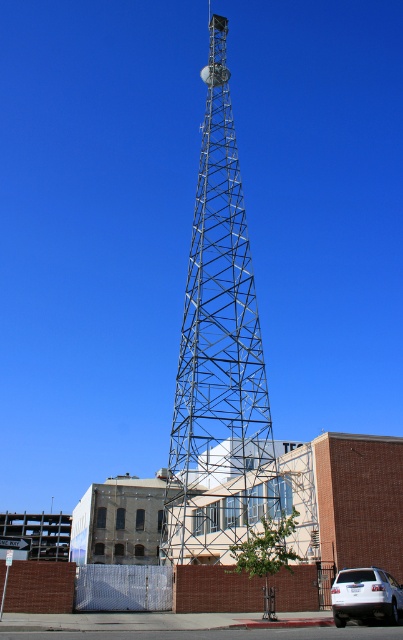
Who is taller, metallic lattice tower at center or white matte suv at lower right?

metallic lattice tower at center is taller.

Can you confirm if metallic lattice tower at center is smaller than white matte suv at lower right?

No.

This screenshot has width=403, height=640. I want to click on metallic lattice tower at center, so (218, 353).